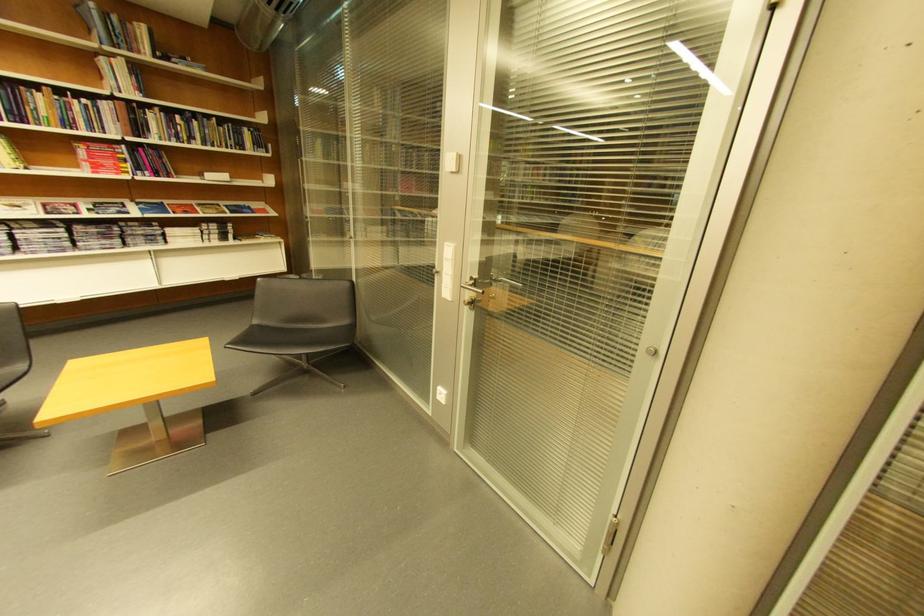
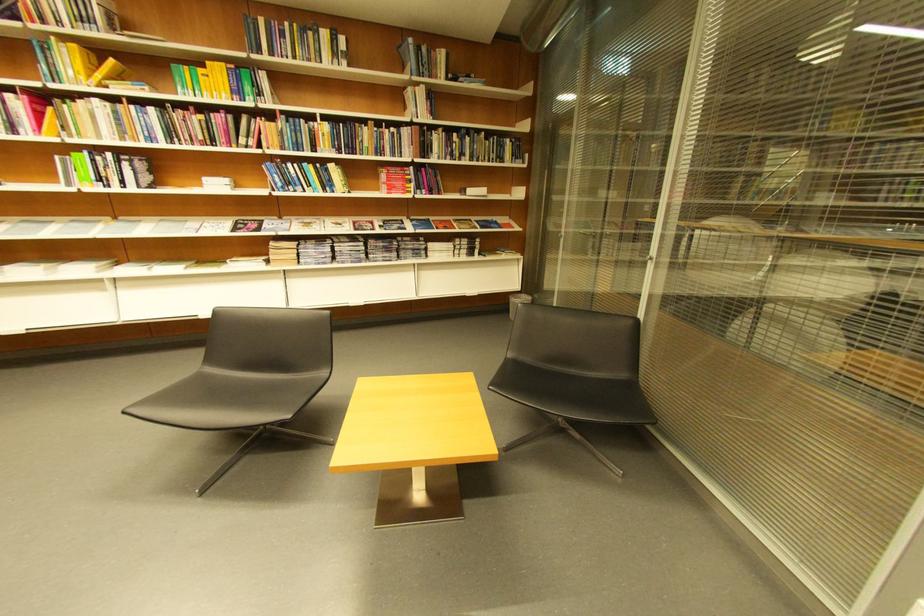
Question: Based on the continuous images, in which direction is the camera rotating? Reply with the corresponding letter.

Choices:
 (A) Left
 (B) Right
 (C) Up
 (D) Down

Answer: (A)